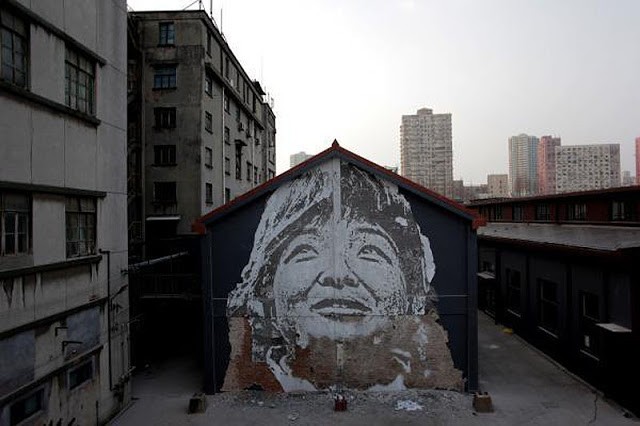
The image size is (640, 426). In order to click on wall in this screenshot , I will do click(x=230, y=250).